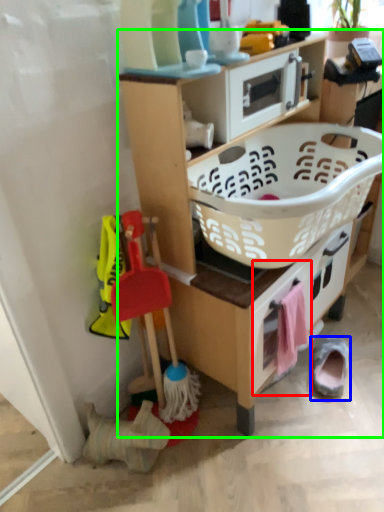
Question: Considering the real-world distances, which object is closest to drawer (highlighted by a red box)? footwear (highlighted by a blue box) or shelf (highlighted by a green box).

Choices:
 (A) footwear
 (B) shelf

Answer: (B)